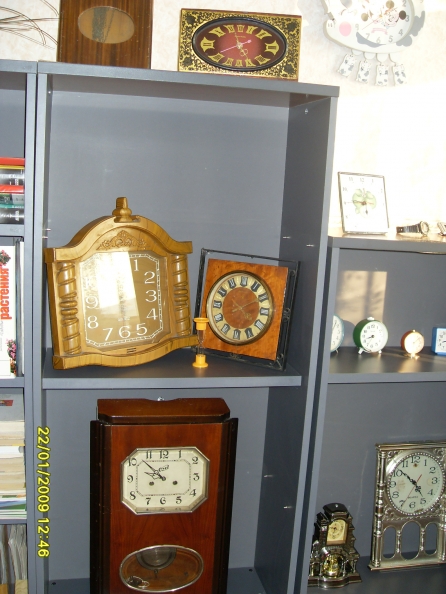
This screenshot has width=446, height=594. I want to click on round clock faces, so click(x=418, y=482), click(x=411, y=340), click(x=373, y=339), click(x=337, y=336), click(x=248, y=311), click(x=380, y=24).